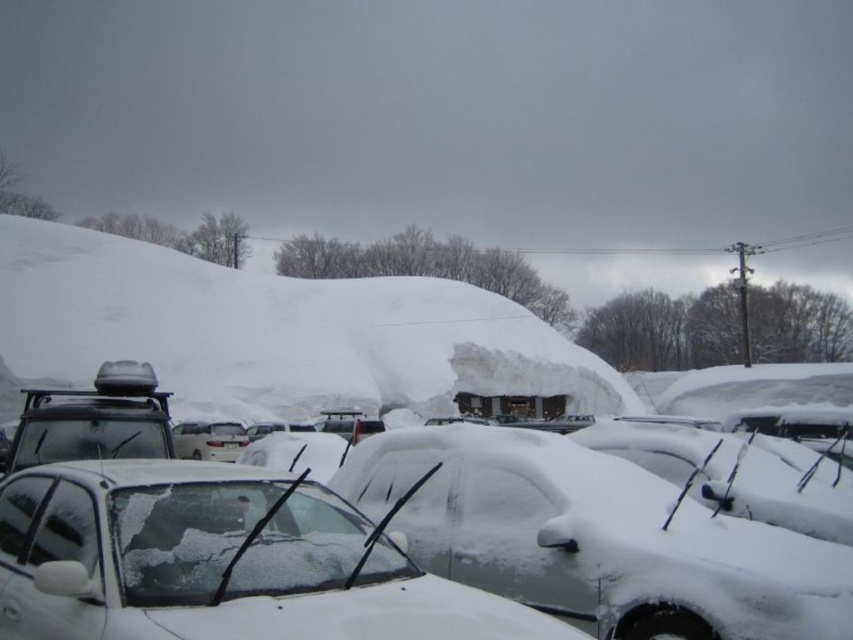
Question: Does white matte car at center appear under snow-covered car at center?

Choices:
 (A) yes
 (B) no

Answer: (A)

Question: Which point is farther to the camera?

Choices:
 (A) white matte car at center
 (B) snow-covered car at center

Answer: (A)

Question: Which object is positioned farthest from the white fluffy snow at upper center?

Choices:
 (A) white matte car at center
 (B) snow-covered car at center

Answer: (A)

Question: Is white fluffy snow at upper center wider than snow-covered car at center?

Choices:
 (A) no
 (B) yes

Answer: (B)

Question: Is white fluffy snow at upper center positioned at the back of snow-covered car at center?

Choices:
 (A) no
 (B) yes

Answer: (B)

Question: Based on their relative distances, which object is farther from the white fluffy snow at upper center?

Choices:
 (A) snow-covered car at center
 (B) white matte car at center

Answer: (B)